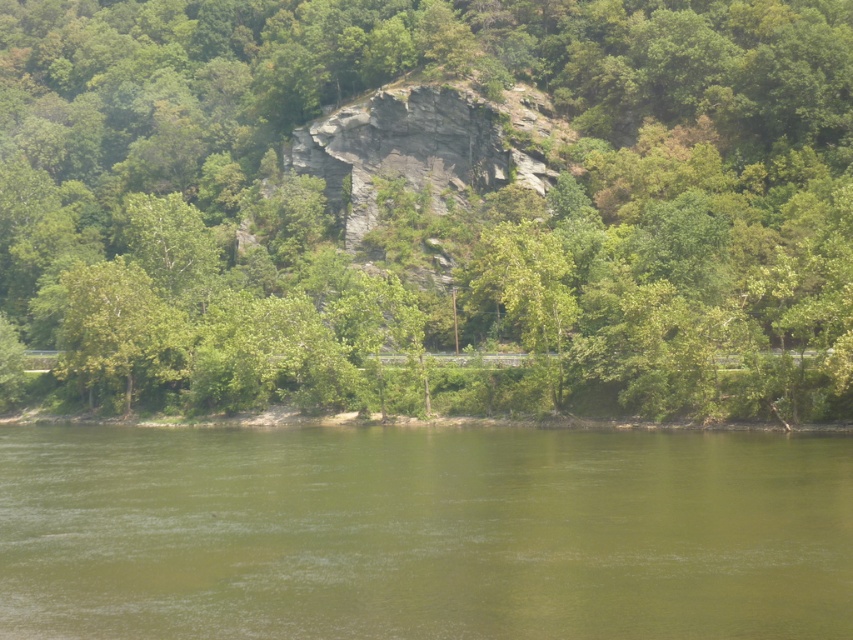
You are standing in the natural landscape and want to walk towards the green leafy tree at center. Will you have to cross the green water at lower center to reach it?

The green leafy tree at center is further to the viewer than green water at lower center, so you will not have to cross the green water at lower center to reach it. The tree is closer, so you can approach it without going through the water.

You are standing at the edge of the green water at lower center and want to take a photo of the green leafy tree at center. Since the tree is taller than the water, will the tree appear larger in the photo compared to the water?

The green leafy tree at center is taller than the green water at lower center, so in the photo taken from the edge of the water, the tree will appear larger than the water in the frame.

You are standing at the edge of the water in the scene. Which object, the green leafy tree at center or the green water at lower center, is closer to your viewpoint?

The green water at lower center is closer to your viewpoint because it is at the lower center, while the green leafy tree at center is above it.